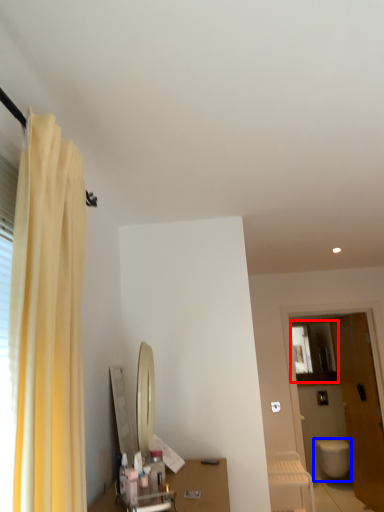
Question: Among these objects, which one is nearest to the camera, medicine cabinet (highlighted by a red box) or toilet (highlighted by a blue box)?

Choices:
 (A) medicine cabinet
 (B) toilet

Answer: (B)